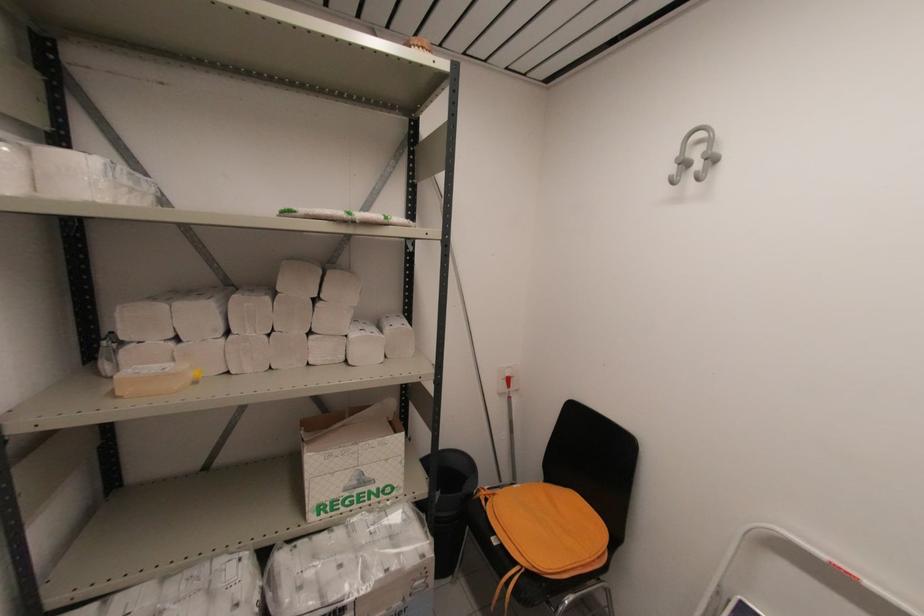
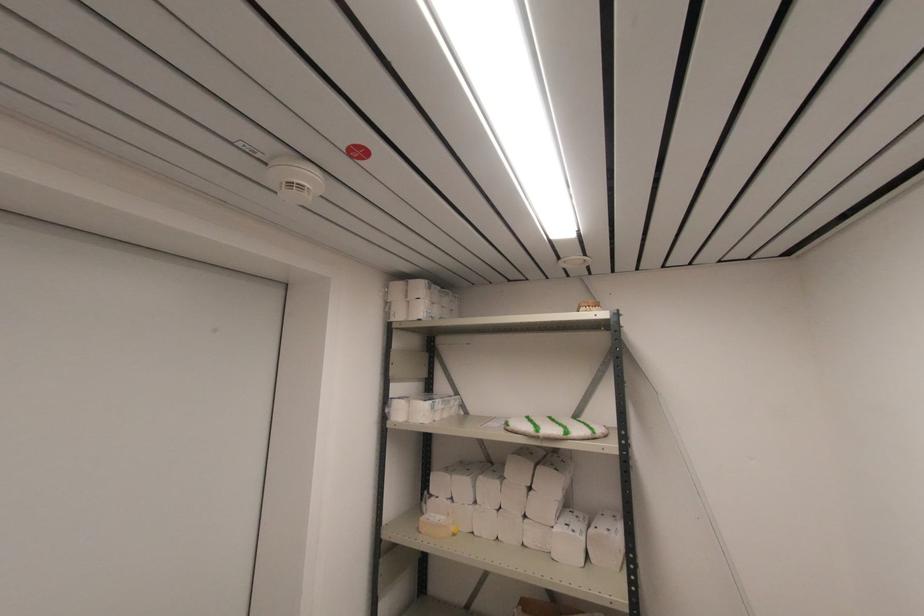
The point at (350,217) is marked in the first image. Where is the corresponding point in the second image?

(537, 436)